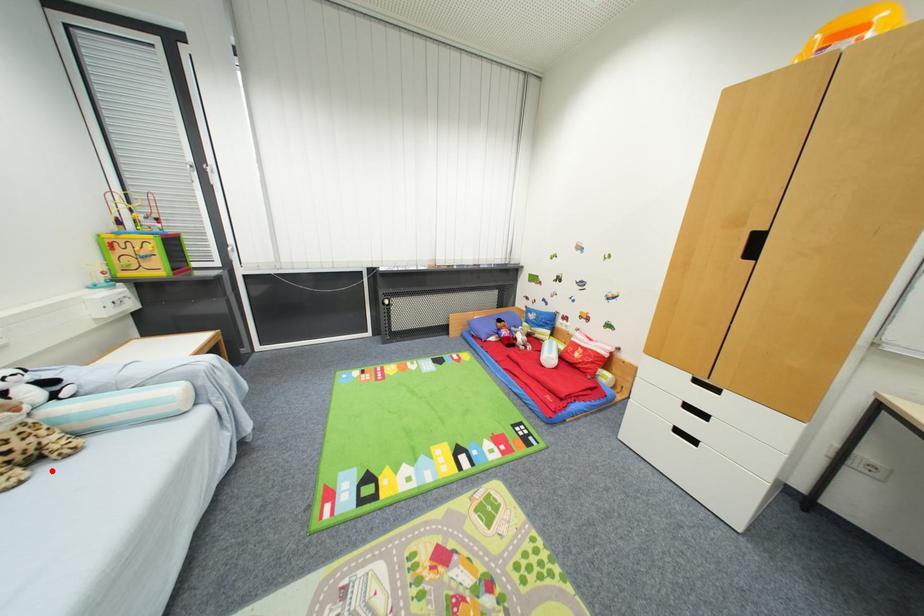
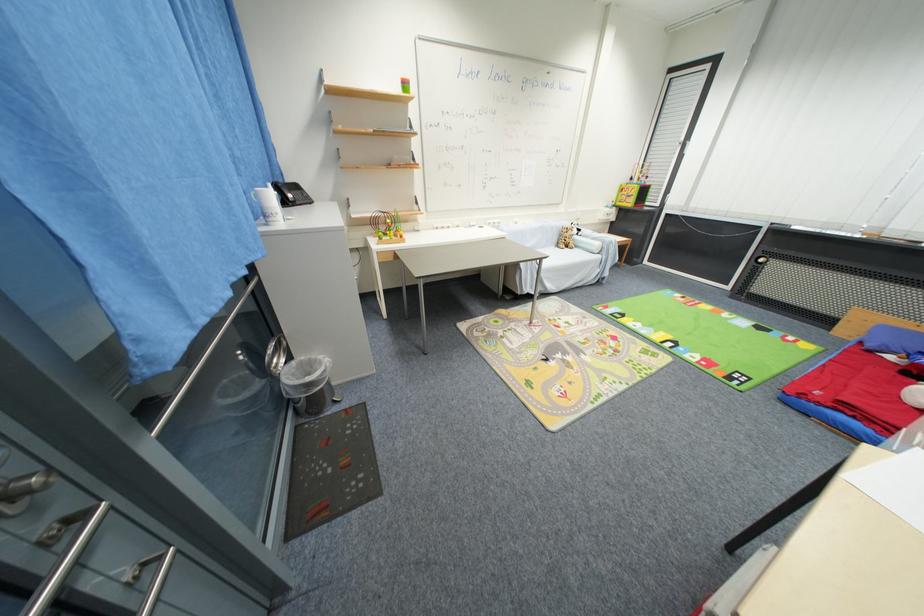
Find the pixel in the second image that matches the highlighted location in the first image.

(572, 251)